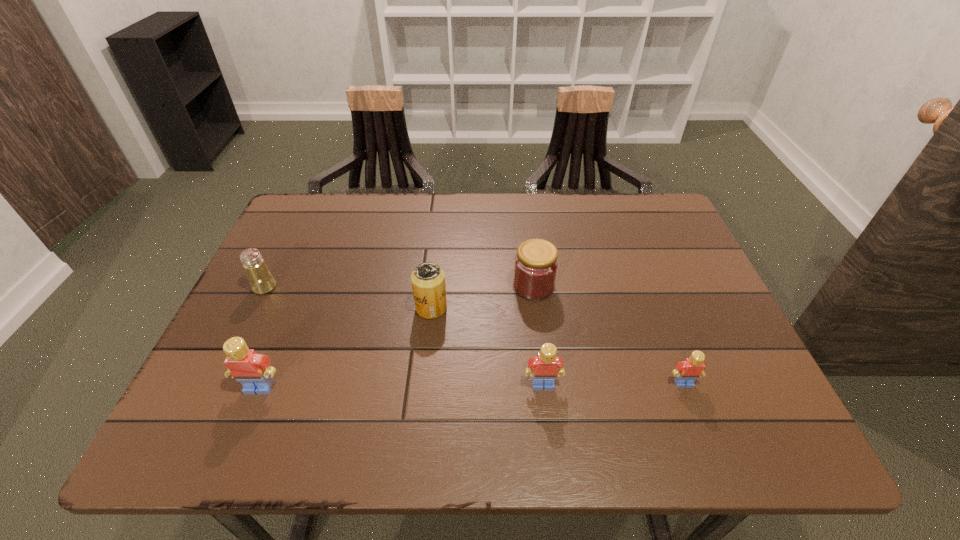
Identify the location of vacant point located between the second Lego from right to left and the third object from left to right. (487, 346).

Identify the location of vacant area that lies between the second object from left to right and the second Lego from left to right. This screenshot has width=960, height=540. (401, 386).

I want to click on object that can be found as the fourth closest to the second tallest Lego, so click(252, 370).

Choose which object is the fourth nearest neighbor to the jam. Please provide its 2D coordinates. Your answer should be formatted as a tuple, i.e. [(x, y)], where the tuple contains the x and y coordinates of a point satisfying the conditions above.

[(252, 370)]

Select which Lego is the closest to the shortest Lego. Please provide its 2D coordinates. Your answer should be formatted as a tuple, i.e. [(x, y)], where the tuple contains the x and y coordinates of a point satisfying the conditions above.

[(544, 368)]

Locate an element on the screen. This screenshot has height=540, width=960. Lego that is the nearest to the fourth object from right to left is located at coordinates 544,368.